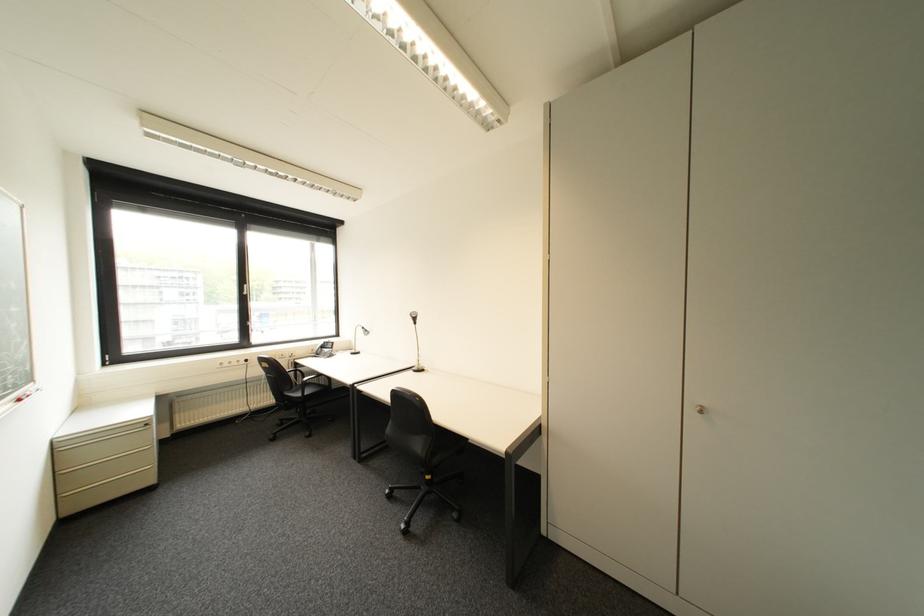
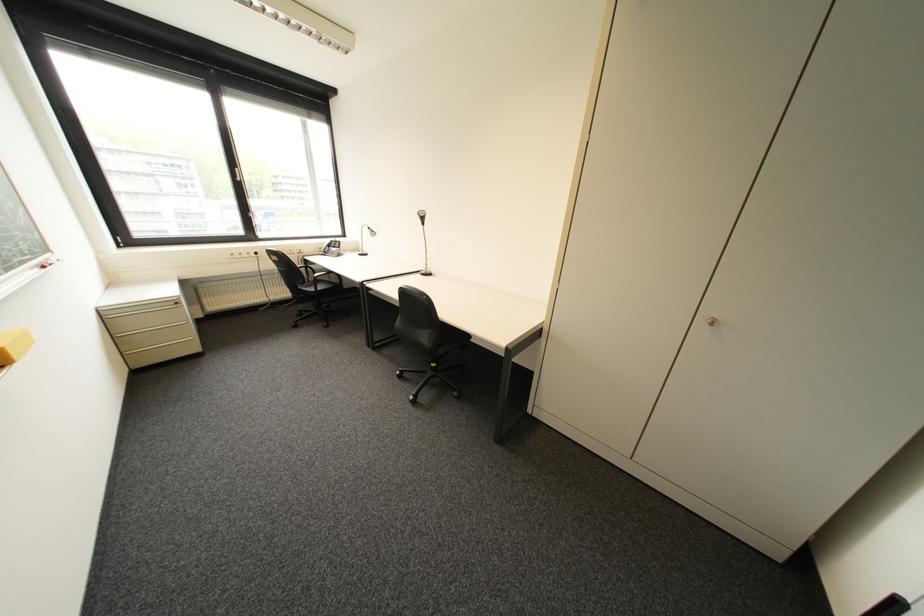
Locate, in the second image, the point that corresponds to pixel 289 424 in the first image.

(309, 314)